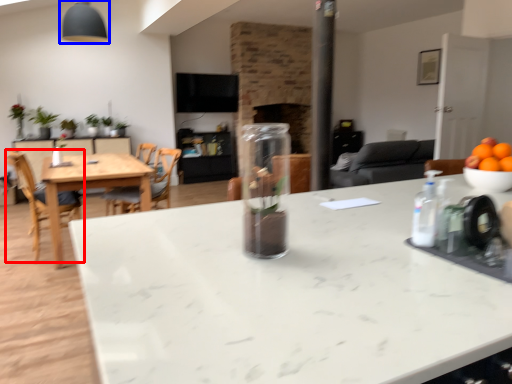
Question: Which object is further to the camera taking this photo, chair (highlighted by a red box) or fixture (highlighted by a blue box)?

Choices:
 (A) chair
 (B) fixture

Answer: (B)